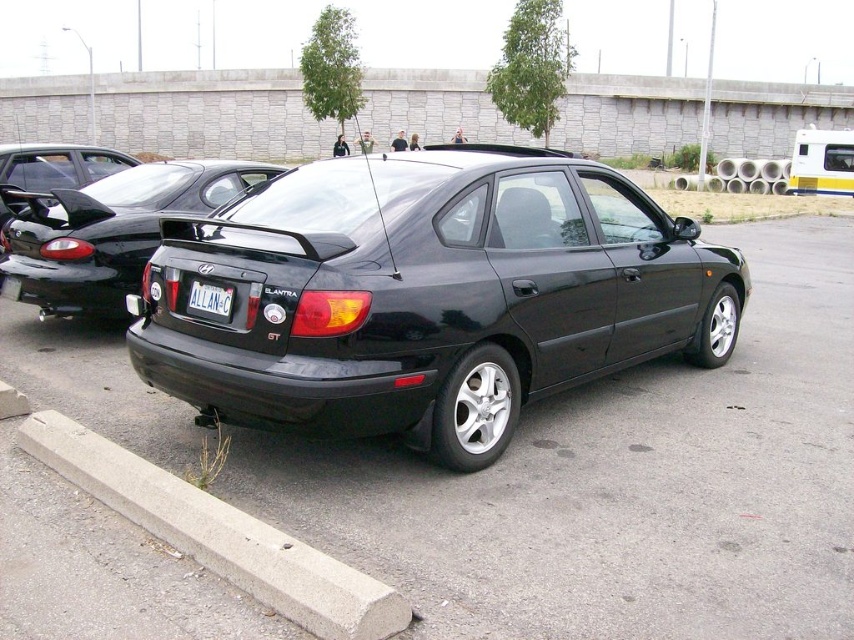
Which of these two, black matte car at center or black plastic license plate at center, stands shorter?

black plastic license plate at center

Where is `black matte car at center`? This screenshot has height=640, width=854. black matte car at center is located at coordinates (623, 484).

Can you confirm if concrete at lower left is smaller than black plastic license plate at center?

No, concrete at lower left is not smaller than black plastic license plate at center.

Consider the image. Who is lower down, concrete at lower left or black plastic license plate at center?

concrete at lower left is lower down.

This screenshot has height=640, width=854. Describe the element at coordinates (219, 534) in the screenshot. I see `concrete at lower left` at that location.

Where is `concrete at lower left`? concrete at lower left is located at coordinates (219, 534).

Based on the photo, between concrete at lower left and glossy black car at center, which one appears on the right side from the viewer's perspective?

concrete at lower left is more to the right.

Is concrete at lower left taller than glossy black car at center?

No, concrete at lower left is not taller than glossy black car at center.

The height and width of the screenshot is (640, 854). What are the coordinates of `concrete at lower left` in the screenshot? It's located at (219, 534).